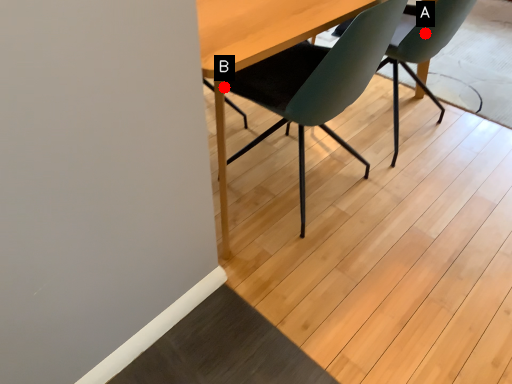
Question: Two points are circled on the image, labeled by A and B beside each circle. Among these points, which one is farthest from the camera?

Choices:
 (A) A is further
 (B) B is further

Answer: (A)